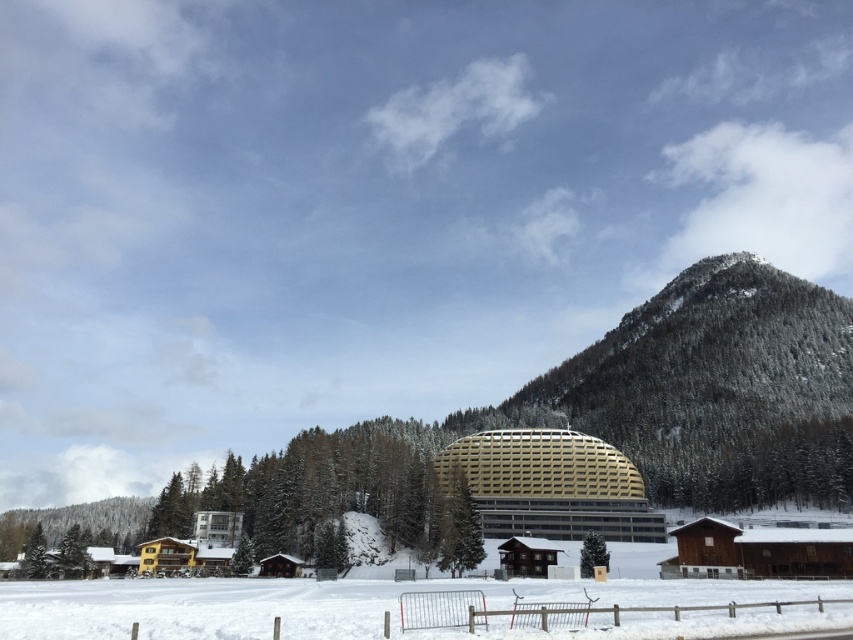
You are a photographer planning to take a picture of the gold metallic dome at center from the white powdery snow at lower center. Considering the height difference between them, will the dome be fully visible in your photo?

The white powdery snow at lower center is taller than the gold metallic dome at center, so the dome might be partially obscured or not fully visible in the photo due to the snowbank being higher in elevation.

You are planning to build a small cabin on the white powdery snow at lower center. Considering the green textured mountain at center, how does its width compare to the snow area available for your cabin?

The green textured mountain at center is wider than the white powdery snow at lower center, so the snow area available for the cabin is narrower than the mountain.